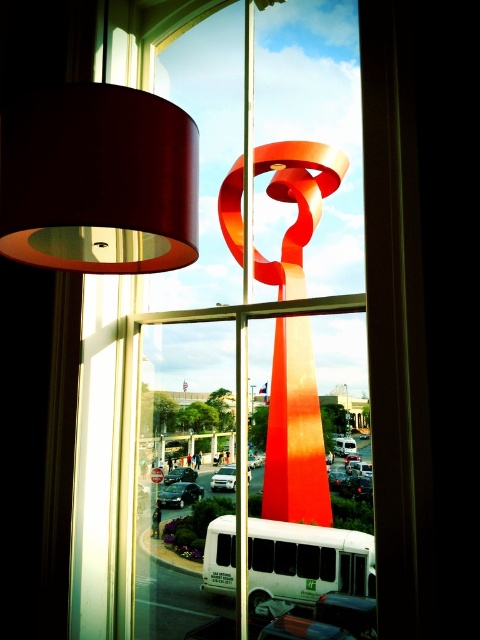
You are an interior designer planning to hang a new decoration. You see the matte brown lampshade at upper left and the shiny orange ribbon at center. Which object is located above the other?

The matte brown lampshade at upper left is positioned over the shiny orange ribbon at center, so it is above the ribbon.

You are standing in a room with a large window. You want to place a small plant exactly at the center of the matte glass window at center. According to the coordinates provided, what are the coordinates where you should place the plant?

The coordinates for the center of the matte glass window at center are at point (x=159, y=342), so you should place the plant there.

You are an interior designer who wants to hang a new picture frame exactly between the matte glass window at center and the shiny orange ribbon at center. What is the minimum distance you need to maintain between the new frame and each object to ensure it is centered?

The minimum distance between the new frame and each object should be half of the total distance between them. Since the matte glass window at center and the shiny orange ribbon at center are 21.53 centimeters apart, dividing this by two gives 10.765 centimeters. Therefore, placing the frame 10.765 centimeters away from both objects will center it perfectly.